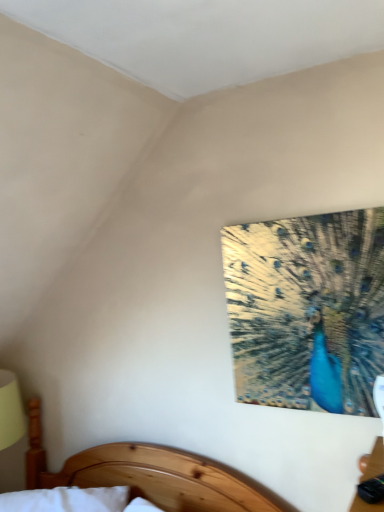
Question: Considering the positions of point (178, 484) and point (284, 371), is point (178, 484) closer or farther from the camera than point (284, 371)?

Choices:
 (A) closer
 (B) farther

Answer: (B)

Question: Is wooden bed at lower center bigger or smaller than shiny metallic peacock at upper right?

Choices:
 (A) big
 (B) small

Answer: (A)

Question: From a real-world perspective, is wooden bed at lower center positioned above or below shiny metallic peacock at upper right?

Choices:
 (A) below
 (B) above

Answer: (A)

Question: In terms of size, does shiny metallic peacock at upper right appear bigger or smaller than wooden bed at lower center?

Choices:
 (A) big
 (B) small

Answer: (B)

Question: Is shiny metallic peacock at upper right in front of or behind wooden bed at lower center in the image?

Choices:
 (A) behind
 (B) front

Answer: (A)

Question: From a real-world perspective, is shiny metallic peacock at upper right physically located above or below wooden bed at lower center?

Choices:
 (A) below
 (B) above

Answer: (B)

Question: Which is correct: shiny metallic peacock at upper right is inside wooden bed at lower center, or outside of it?

Choices:
 (A) outside
 (B) inside

Answer: (A)